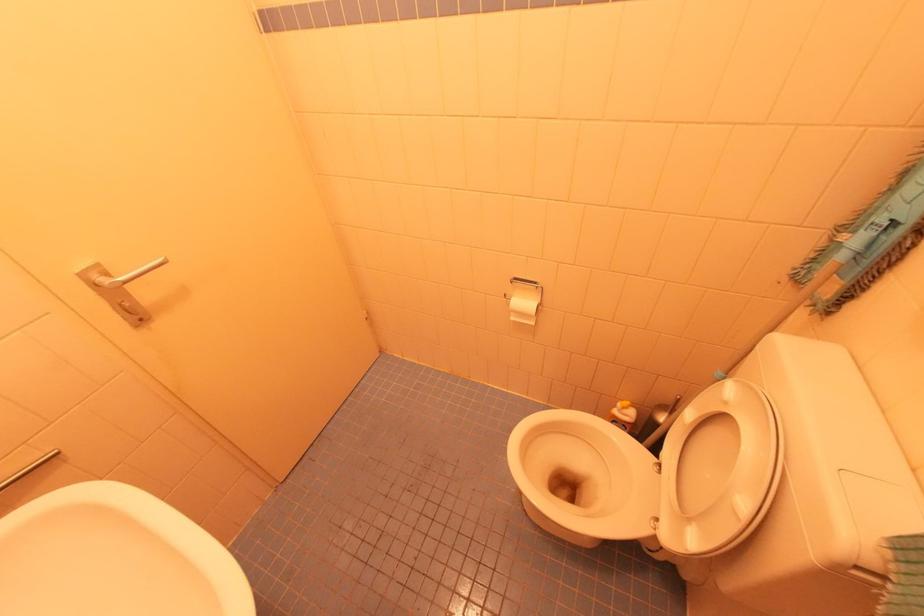
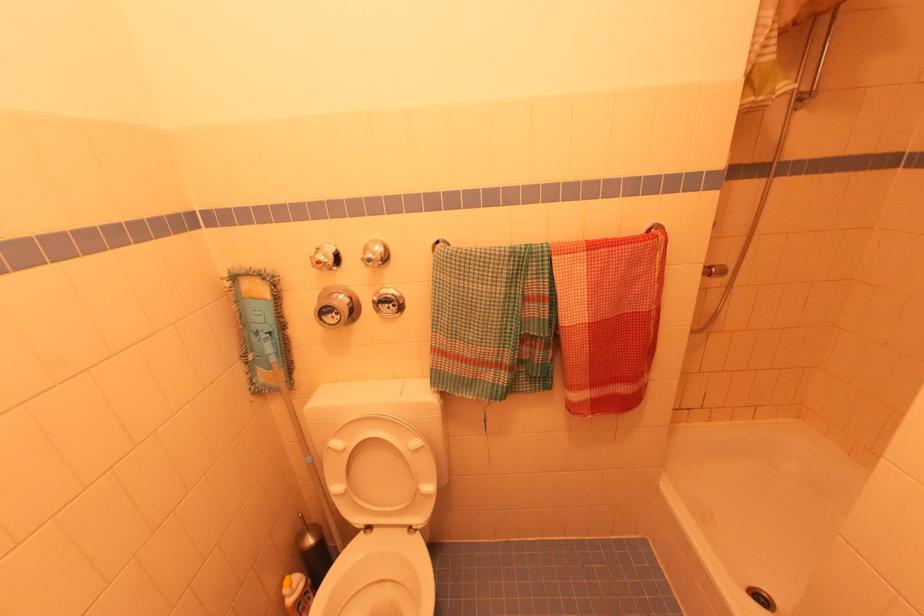
Find the pixel in the second image that matches [869,285] in the first image.

(293, 361)